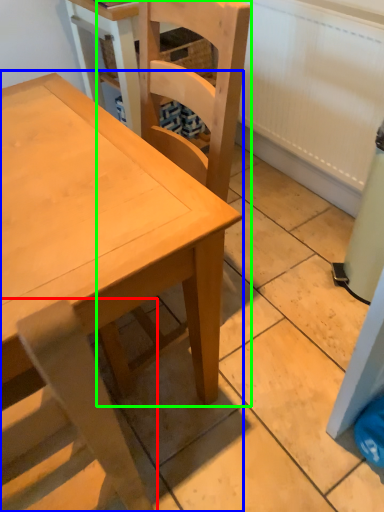
Question: Estimate the real-world distances between objects in this image. Which object is closer to chair (highlighted by a red box), table (highlighted by a blue box) or chair (highlighted by a green box)?

Choices:
 (A) table
 (B) chair

Answer: (A)